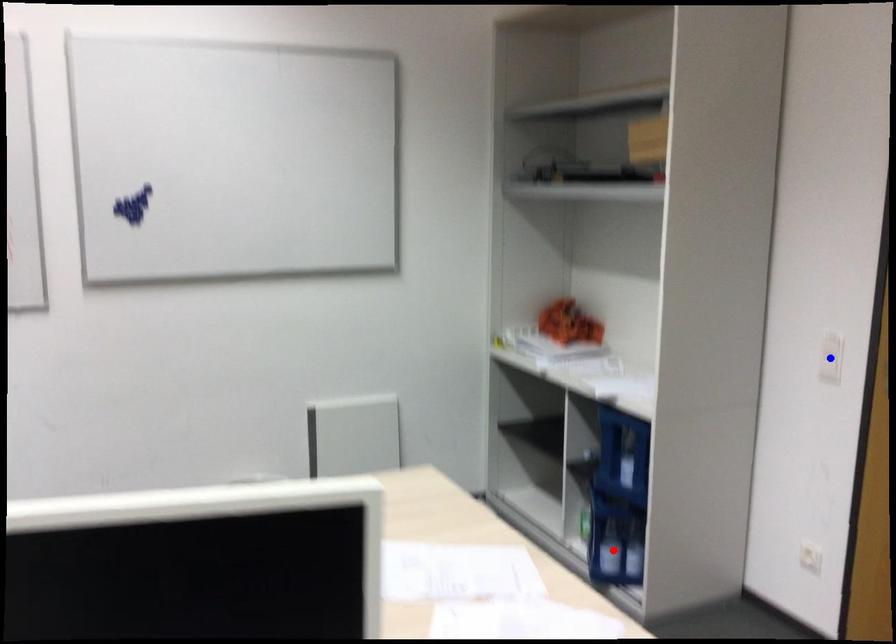
Question: Which of the two points in the image is closer to the camera?

Choices:
 (A) Blue point is closer.
 (B) Red point is closer.

Answer: (A)